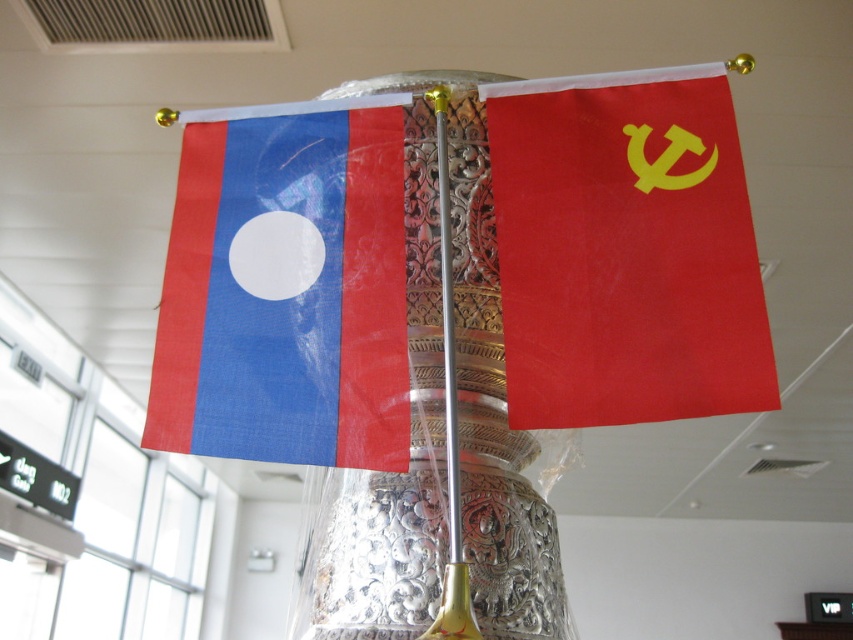
Can you confirm if matte fabric flag at center is positioned to the right of matte fabric flag at left?

Indeed, matte fabric flag at center is positioned on the right side of matte fabric flag at left.

Which is in front, point (614, 148) or point (251, 122)?

Positioned in front is point (614, 148).

Locate an element on the screen. matte fabric flag at center is located at coordinates (625, 250).

Is red matte flag at upper right shorter than matte fabric flag at left?

Yes.

Is red matte flag at upper right above matte fabric flag at left?

Correct, red matte flag at upper right is located above matte fabric flag at left.

Which is behind, point (706, 289) or point (276, 305)?

Positioned behind is point (276, 305).

You are a GUI agent. You are given a task and a screenshot of the screen. Output one action in this format:
    pyautogui.click(x=<x>, y=<y>)
    Task: Click on the red matte flag at upper right
    This screenshot has height=640, width=853.
    Given the screenshot: What is the action you would take?
    pyautogui.click(x=625, y=250)

Can you confirm if red matte flag at upper right is wider than silver metallic vase at center?

In fact, red matte flag at upper right might be narrower than silver metallic vase at center.

Which is below, red matte flag at upper right or silver metallic vase at center?

silver metallic vase at center is lower down.

What do you see at coordinates (625, 250) in the screenshot? I see `red matte flag at upper right` at bounding box center [625, 250].

Where is `red matte flag at upper right`? Image resolution: width=853 pixels, height=640 pixels. red matte flag at upper right is located at coordinates (625, 250).